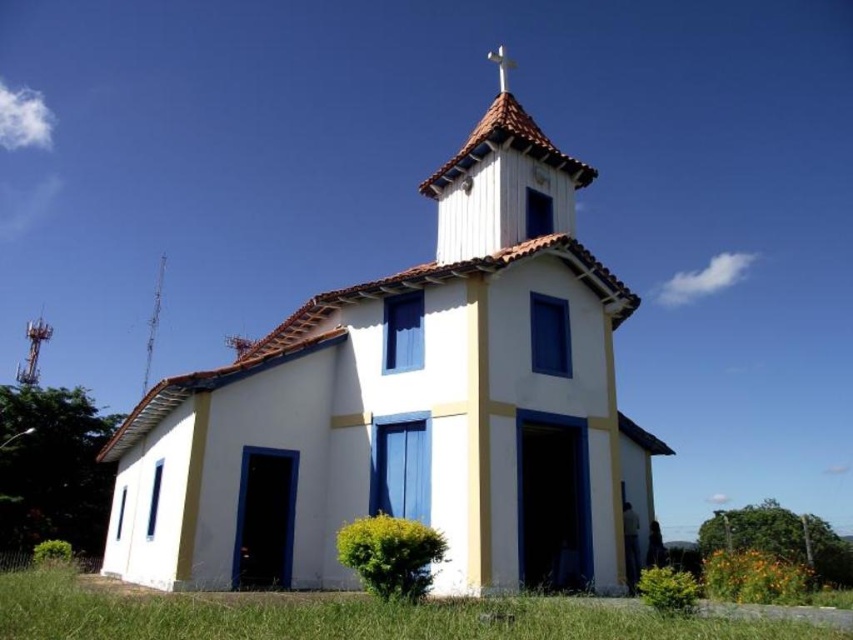
You are standing in front of the church and want to know which object occupies more horizontal space in the image. Based on the scene, which one is wider between the green grass at lower center and the smooth white spire at upper center?

The green grass at lower center is wider than the smooth white spire at upper center according to the description.

structural integrity is a concern for the church. From the perspective of someone standing at the base of the green grass at lower center, will the smooth white spire at upper center block their view of the sky above it?

structural integrity is a concern for the church. From the perspective of someone standing at the base of the green grass at lower center, the smooth white spire at upper center is positioned above it, so it will block their view of the sky above it.